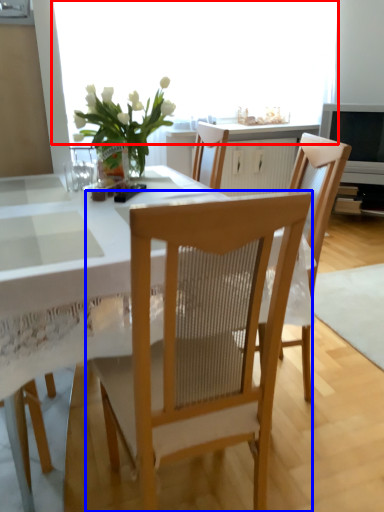
Question: Which object is closer to the camera taking this photo, window screen (highlighted by a red box) or chair (highlighted by a blue box)?

Choices:
 (A) window screen
 (B) chair

Answer: (B)